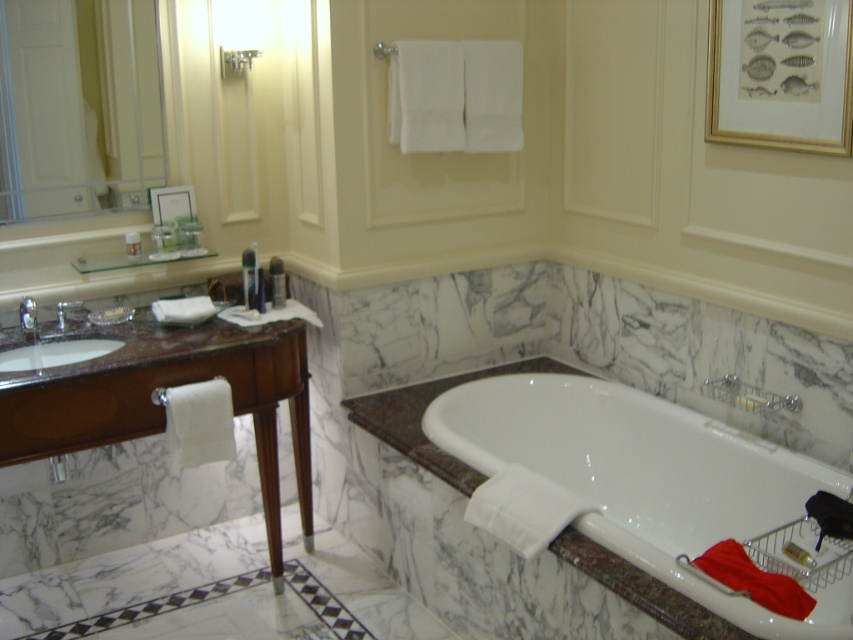
You are standing in the bathroom and want to locate the white glossy bathtub at center. According to the mirror, where should you look relative to the clear glass mirror at upper left?

The white glossy bathtub at center is to the right of the clear glass mirror at upper left, so you should look to the right side of the mirror to find it.

You are standing in the bathroom and see two points marked on the floor. The first point is at point (456, 420) and the second point is at point (196, 404). Which point is further away from you?

Point (456, 420) is behind point (196, 404), so it is further away from you.

You are a guest in this bathroom and need to determine which object is shorter between the white glossy bathtub at center and the clear glass mirror at upper left. Can you identify the shorter object?

The white glossy bathtub at center is shorter than the clear glass mirror at upper left.